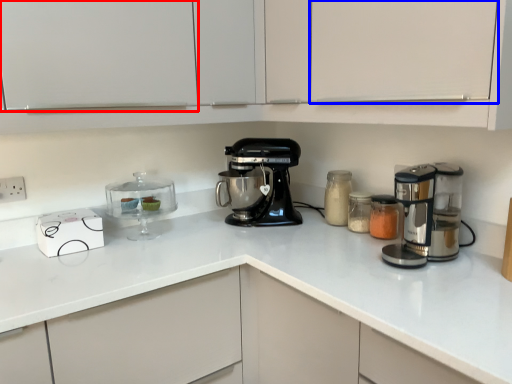
Question: Which of the following is the closest to the observer, cabinetry (highlighted by a red box) or cabinetry (highlighted by a blue box)?

Choices:
 (A) cabinetry
 (B) cabinetry

Answer: (B)